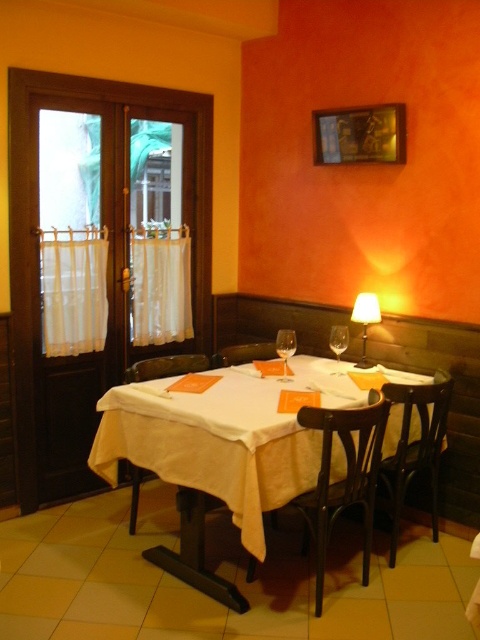
Question: Which of the following is the closest to the observer?

Choices:
 (A) (372, 529)
 (B) (345, 344)
 (C) (362, 307)

Answer: (A)

Question: Which is farther from the dark brown wooden chair at lower right?

Choices:
 (A) brown wooden chair at center
 (B) clear glass wine glass at center

Answer: (A)

Question: Which point is closer to the camera?

Choices:
 (A) brown wooden chair at center
 (B) wooden chair at center
 (C) clear glass wine glass at center
 (D) matte white lampshade at upper right

Answer: (C)

Question: Is brown wooden chair at center bigger than clear glass wine glass at center?

Choices:
 (A) yes
 (B) no

Answer: (A)

Question: Is dark brown wooden chair at lower right wider than wooden chair at center?

Choices:
 (A) yes
 (B) no

Answer: (B)

Question: Does white matte table at center appear on the right side of clear glass wine glass at center?

Choices:
 (A) no
 (B) yes

Answer: (A)